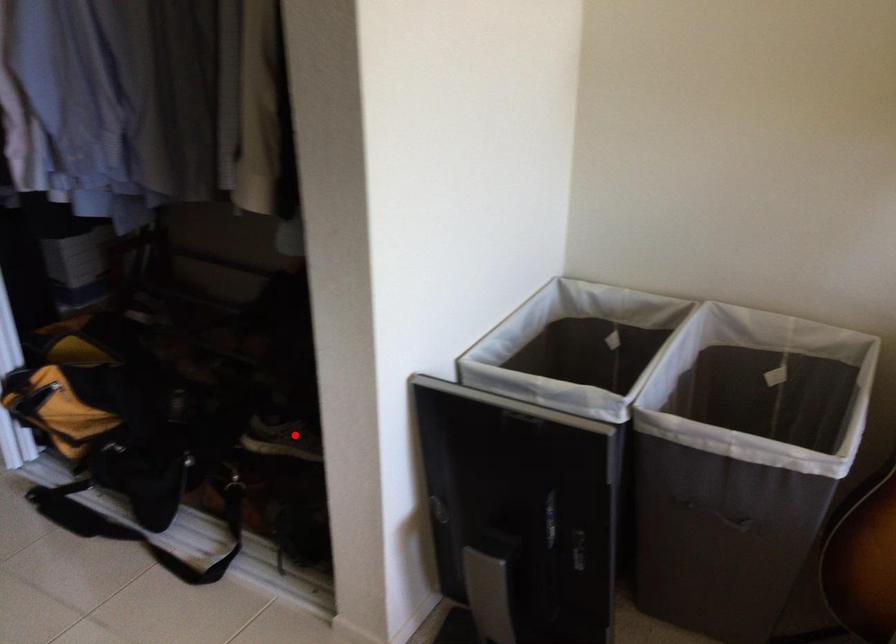
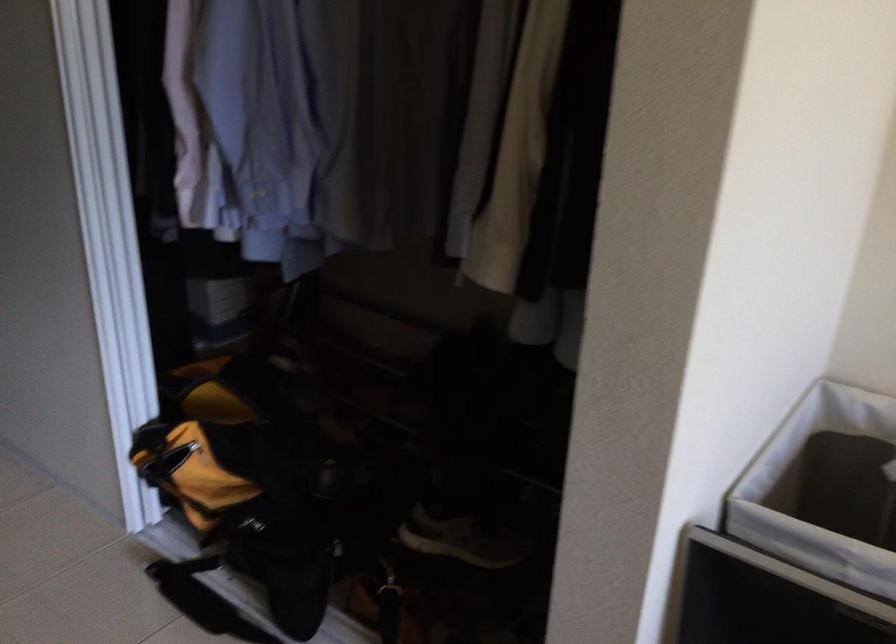
Question: A red point is marked in image1. In image2, is the corresponding 3D point closer to the camera or farther? Reply with the corresponding letter.

Choices:
 (A) The corresponding 3D point is closer.
 (B) The corresponding 3D point is farther.

Answer: (A)